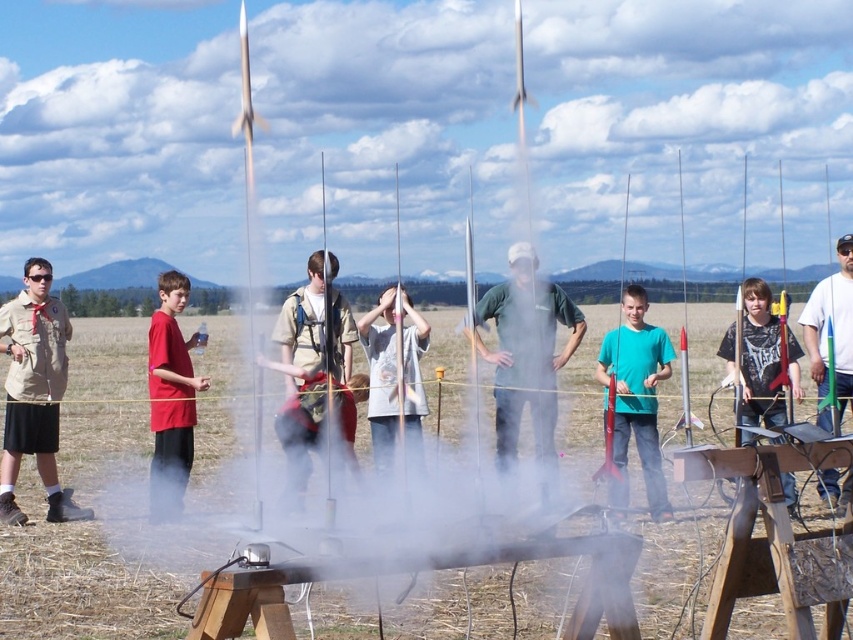
Question: Based on their relative distances, which object is farther from the matte black shirt at center?

Choices:
 (A) white matte t-shirt at center
 (B) red shirt at center
 (C) matte red shirt at center

Answer: (C)

Question: Among these points, which one is farthest from the camera?

Choices:
 (A) (776, 348)
 (B) (413, 326)

Answer: (B)

Question: Can you confirm if green matte shirt at center is bigger than matte red shirt at center?

Choices:
 (A) no
 (B) yes

Answer: (B)

Question: Is green matte shirt at center bigger than teal matte shirt at center?

Choices:
 (A) no
 (B) yes

Answer: (B)

Question: Which point is farther to the camera?

Choices:
 (A) green plastic rocket at center
 (B) red shirt at center
 (C) white matte t-shirt at center

Answer: (A)

Question: Is khaki uniform at left positioned behind teal matte shirt at center?

Choices:
 (A) no
 (B) yes

Answer: (B)